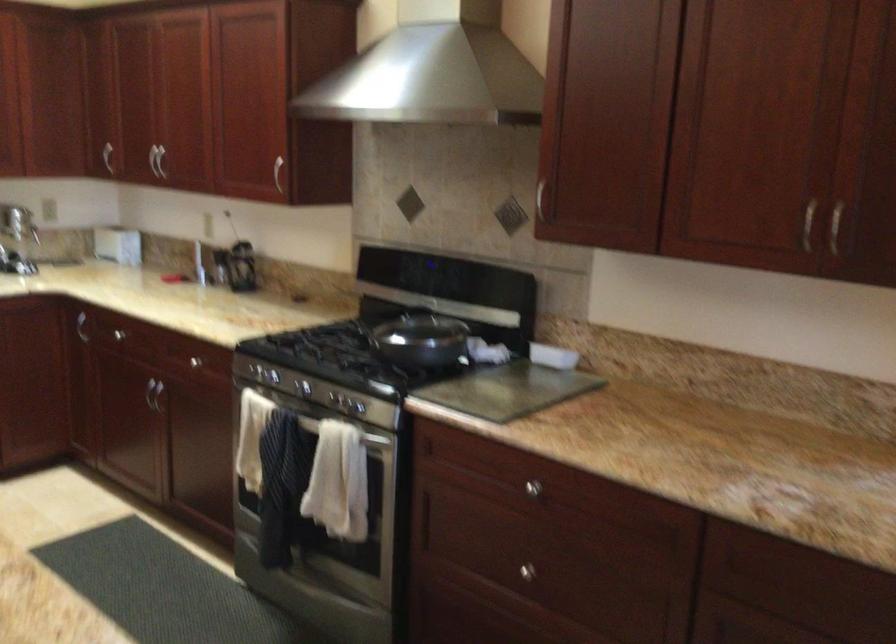
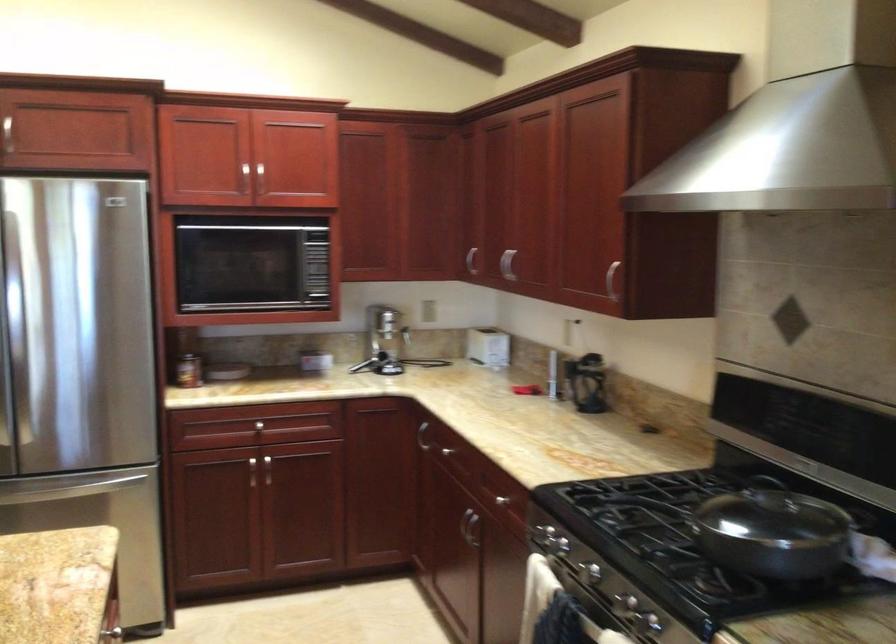
Question: The camera is either moving clockwise (left) or counter-clockwise (right) around the object. The first image is from the beginning of the video and the second image is from the end. Is the camera moving left or right when shooting the video?

Choices:
 (A) Left
 (B) Right

Answer: (B)